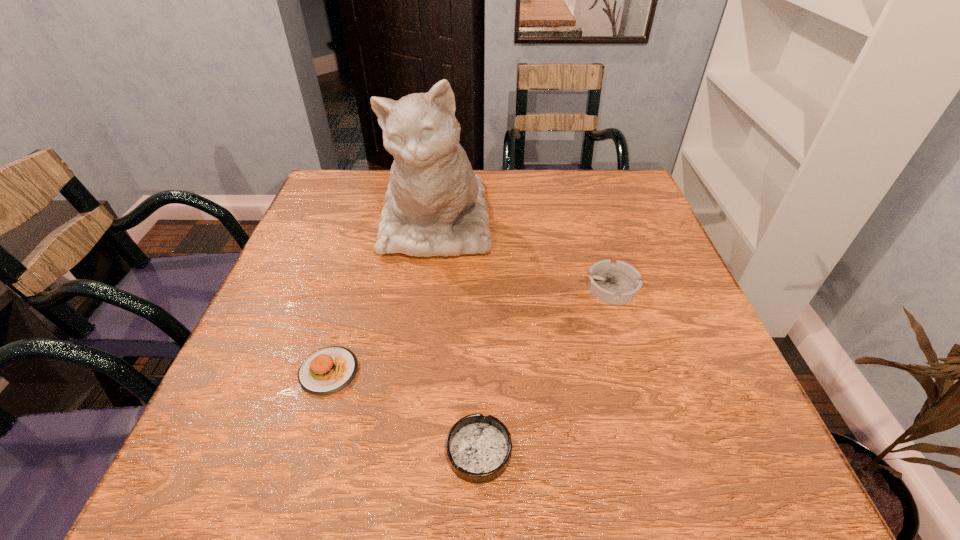
Locate an element on the screen. The image size is (960, 540). cat is located at coordinates (435, 206).

The height and width of the screenshot is (540, 960). Find the location of `the farther ashtray`. the farther ashtray is located at coordinates (617, 284).

Find the location of a particular element. the rightmost object is located at coordinates (617, 284).

Where is `the second nearest object`? This screenshot has width=960, height=540. the second nearest object is located at coordinates (327, 370).

Find the location of a particular element. The image size is (960, 540). the left ashtray is located at coordinates (479, 448).

Find the location of a particular element. This screenshot has width=960, height=540. the shortest object is located at coordinates coord(479,448).

I want to click on vacant area located 0.160m on the front-facing side of the tallest object, so click(x=422, y=330).

The height and width of the screenshot is (540, 960). Find the location of `blank space located on the right of the farther ashtray`. blank space located on the right of the farther ashtray is located at coordinates (680, 287).

Identify the location of vacant region located 0.110m on the front of the second nearest object. (303, 458).

What are the coordinates of `vacant point located 0.060m on the right of the shorter ashtray` in the screenshot? It's located at (549, 451).